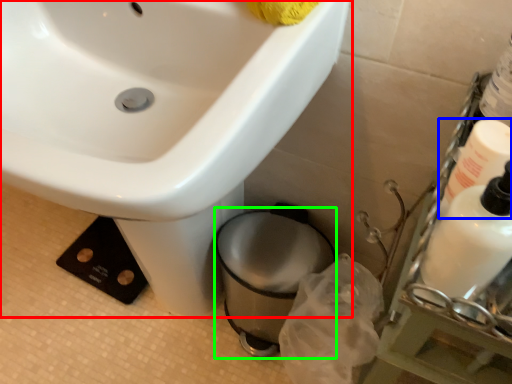
Question: Which object is the closest to the sink (highlighted by a red box)? Choose among these: cleaning product (highlighted by a blue box) or toilet bowl (highlighted by a green box).

Choices:
 (A) cleaning product
 (B) toilet bowl

Answer: (B)